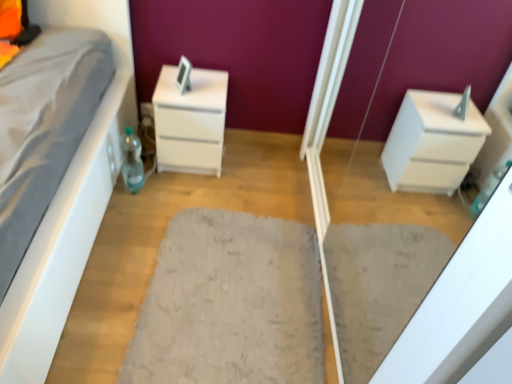
Find the location of a particular element. This screenshot has height=384, width=512. vacant region to the left of gray fluffy rug at center is located at coordinates (118, 274).